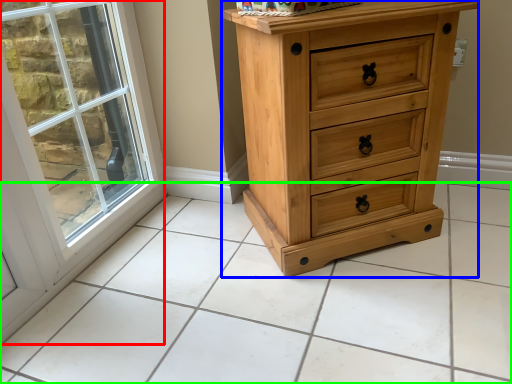
Question: Which is nearer to the window (highlighted by a red box)? chest of drawers (highlighted by a blue box) or tile (highlighted by a green box).

Choices:
 (A) chest of drawers
 (B) tile

Answer: (B)